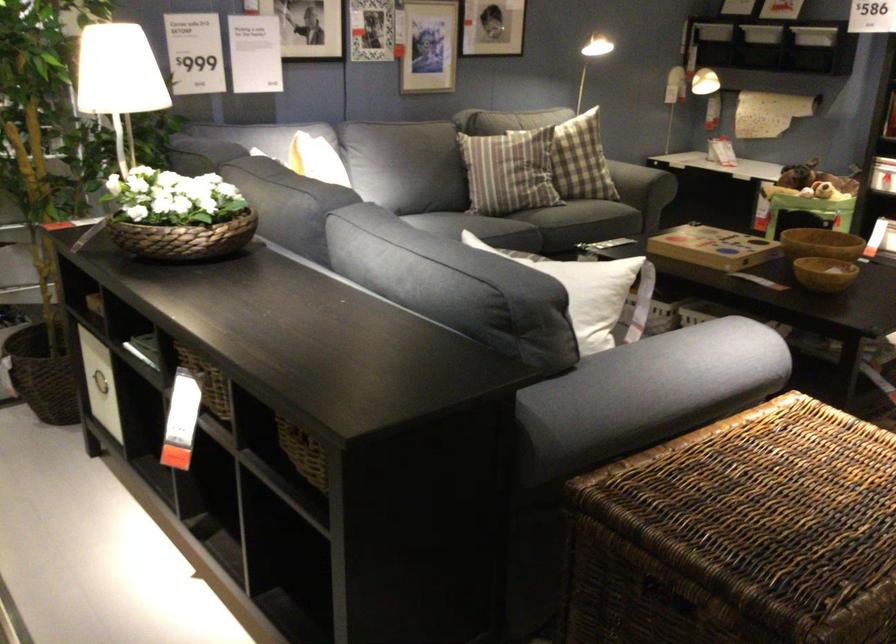
The height and width of the screenshot is (644, 896). Describe the element at coordinates (484, 227) in the screenshot. I see `the sofa sitting surface` at that location.